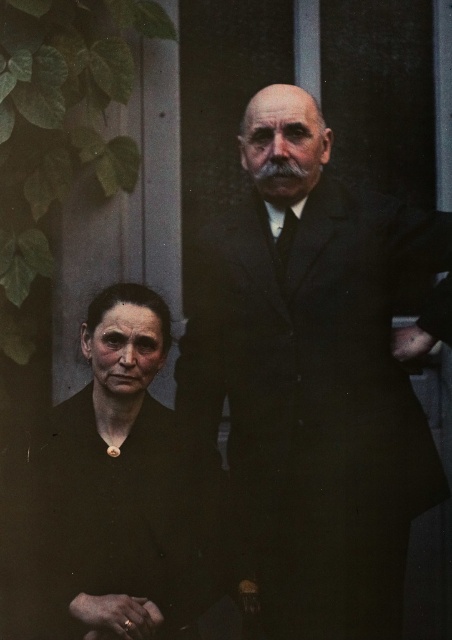
Does dark brown suit at center have a lesser width compared to dark brown fabric at lower left?

No, dark brown suit at center is not thinner than dark brown fabric at lower left.

Measure the distance between dark brown suit at center and camera.

The distance of dark brown suit at center from camera is 6.30 feet.

Where is `dark brown suit at center`? The image size is (452, 640). dark brown suit at center is located at coordinates pyautogui.click(x=314, y=378).